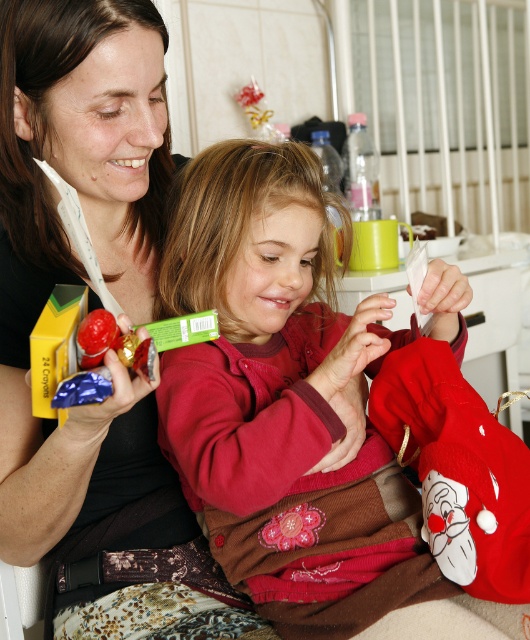
Question: Which object appears closest to the camera in this image?

Choices:
 (A) shiny metallic chocolate at center
 (B) matte black shirt at center
 (C) velvet red sweater at center

Answer: (A)

Question: Which of the following is the farthest from the observer?

Choices:
 (A) (2, 234)
 (B) (250, 218)
 (C) (114, 314)

Answer: (A)

Question: Considering the relative positions of matte black shirt at center and shiny metallic chocolate at center in the image provided, where is matte black shirt at center located with respect to shiny metallic chocolate at center?

Choices:
 (A) left
 (B) right

Answer: (A)

Question: Is the position of velvet red sweater at center more distant than that of shiny metallic chocolate at center?

Choices:
 (A) yes
 (B) no

Answer: (A)

Question: Does matte black shirt at center have a lesser width compared to shiny metallic chocolate at center?

Choices:
 (A) yes
 (B) no

Answer: (B)

Question: Among these points, which one is farthest from the camera?

Choices:
 (A) (80, 326)
 (B) (350, 358)
 (C) (70, 54)

Answer: (B)